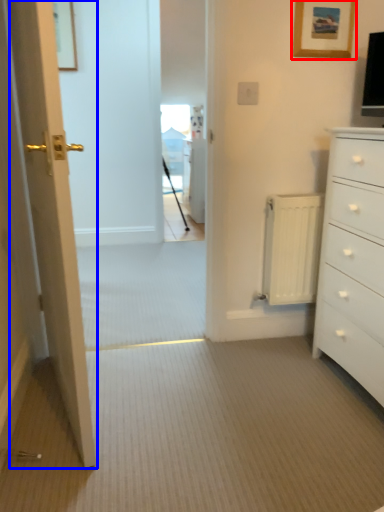
Question: Which object is closer to the camera taking this photo, picture frame (highlighted by a red box) or door (highlighted by a blue box)?

Choices:
 (A) picture frame
 (B) door

Answer: (B)